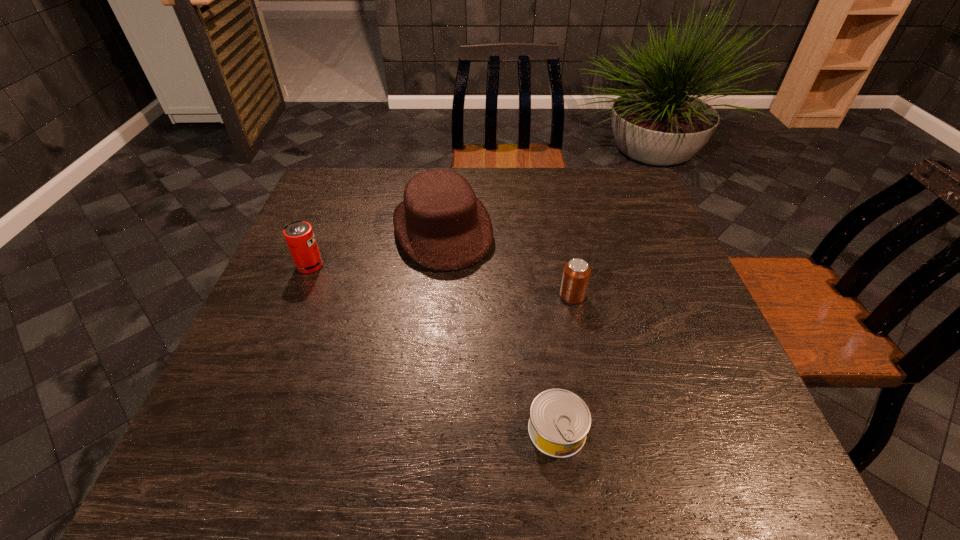
Where is `blank space located 0.320m on the right of the nearest object`? The width and height of the screenshot is (960, 540). blank space located 0.320m on the right of the nearest object is located at coordinates (762, 430).

Identify the location of object positioned at the far edge. This screenshot has width=960, height=540. (441, 225).

This screenshot has width=960, height=540. What are the coordinates of `object at the near edge` in the screenshot? It's located at (559, 422).

At what (x,y) coordinates should I click in order to perform the action: click on object at the left edge. Please return your answer as a coordinate pair (x, y). The height and width of the screenshot is (540, 960). Looking at the image, I should click on (299, 235).

In order to click on free space at the far edge of the desktop in this screenshot , I will do `click(544, 170)`.

Locate an element on the screen. free space at the near edge of the desktop is located at coordinates (377, 449).

The image size is (960, 540). I want to click on free space at the left edge of the desktop, so click(x=342, y=233).

The image size is (960, 540). I want to click on vacant region at the right edge of the desktop, so [x=634, y=255].

The width and height of the screenshot is (960, 540). I want to click on vacant space at the far left corner of the desktop, so click(346, 207).

At what (x,y) coordinates should I click in order to perform the action: click on blank space at the far right corner of the desktop. Please return your answer as a coordinate pair (x, y). Image resolution: width=960 pixels, height=540 pixels. Looking at the image, I should click on (611, 188).